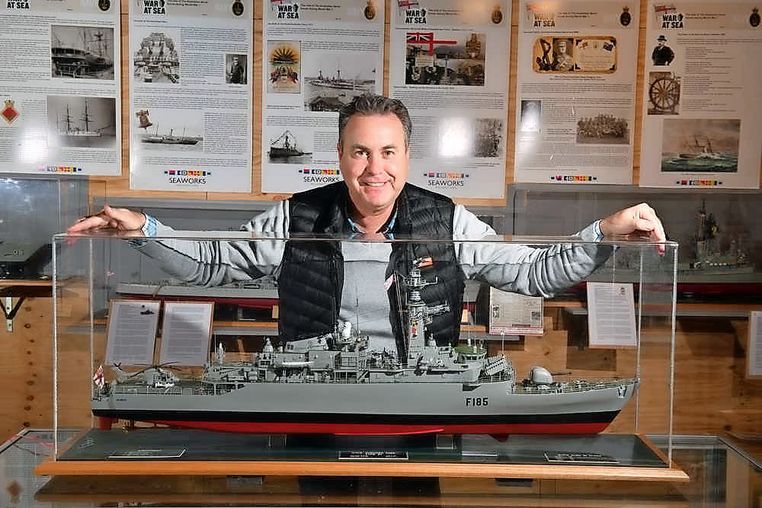
This screenshot has height=508, width=762. I want to click on glass encasing for model battleship, so click(x=74, y=310), click(x=658, y=337), click(x=370, y=443), click(x=232, y=309).